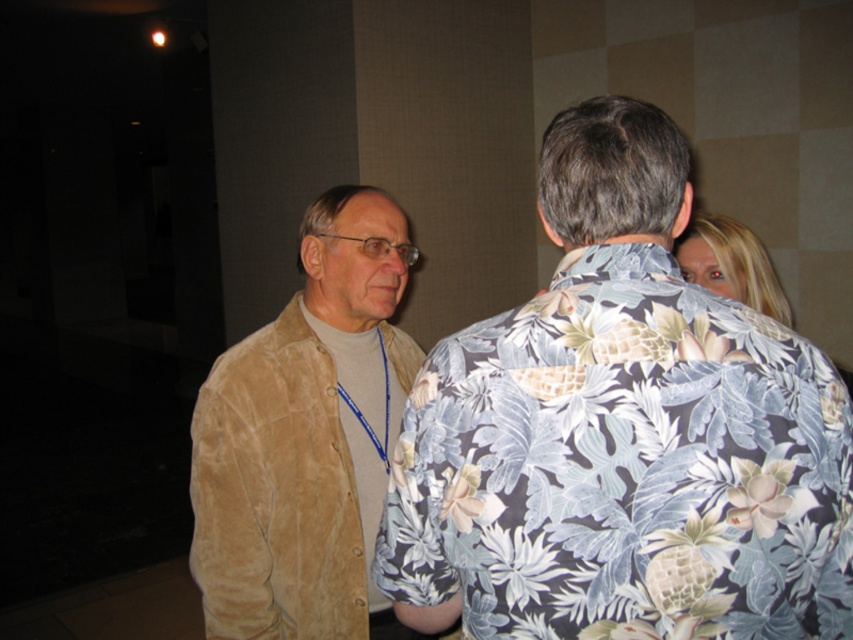
You are a security guard in a building and you see the floral print shirt at center and the suede jacket at left in the surveillance footage. Which one is higher in the image?

The floral print shirt at center is higher in the image than the suede jacket at left.

Based on the scene, which object is bigger, the suede jacket at left or the blonde hair at upper right?

The suede jacket at left has a larger size compared to the blonde hair at upper right.

Based on the coordinates provided, where is the suede jacket at left positioned in the image?

The suede jacket at left is positioned at the 2D coordinates point [305,438].